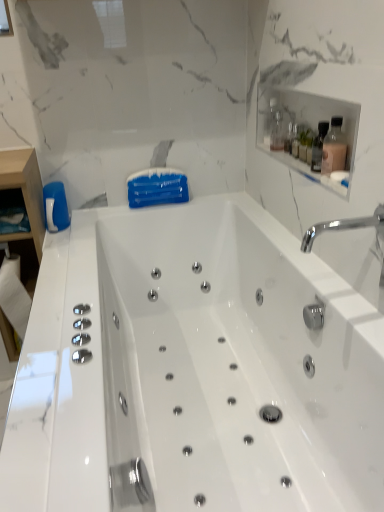
Question: Is white glossy bathtub at center inside the boundaries of chrome metallic faucet at upper right, or outside?

Choices:
 (A) outside
 (B) inside

Answer: (A)

Question: Does point (205, 387) appear closer or farther from the camera than point (362, 220)?

Choices:
 (A) farther
 (B) closer

Answer: (A)

Question: Which object is the farthest from the white glossy bathtub at center?

Choices:
 (A) matte pink glass bottle at upper right, which is counted as the first bottle, starting from the front
 (B) chrome metallic faucet at upper right
 (C) clear glass shelf at upper right
 (D) clear glass bottle at upper right, acting as the 1th bottle starting from the back

Answer: (D)

Question: Estimate the real-world distances between objects in this image. Which object is farther from the chrome metallic faucet at upper right?

Choices:
 (A) white glossy bathtub at center
 (B) matte pink glass bottle at upper right, positioned as the second bottle in left-to-right order
 (C) clear glass bottle at upper right, the 2th bottle ordered from the bottom
 (D) clear glass shelf at upper right

Answer: (C)